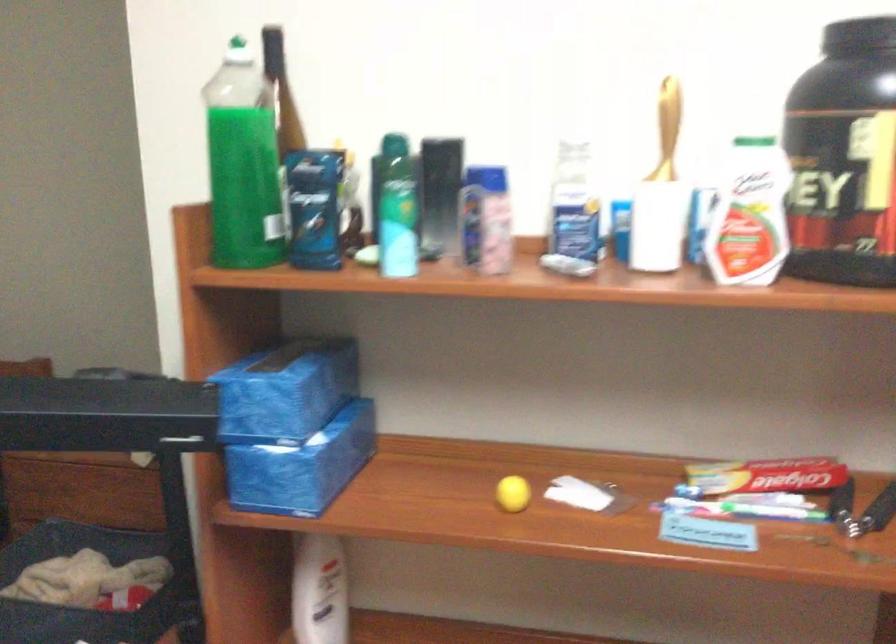
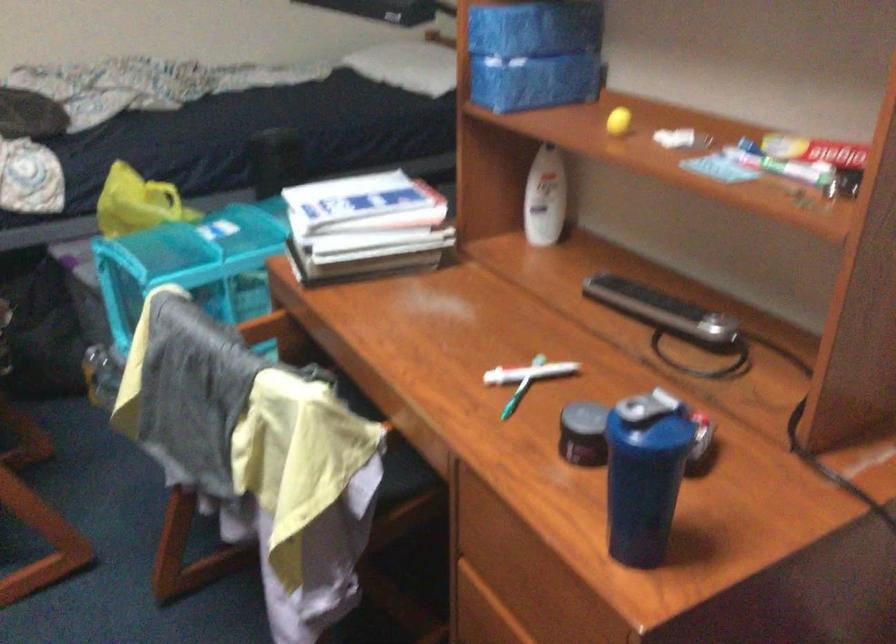
In the second image, find the point that corresponds to [737,500] in the first image.

(780, 164)